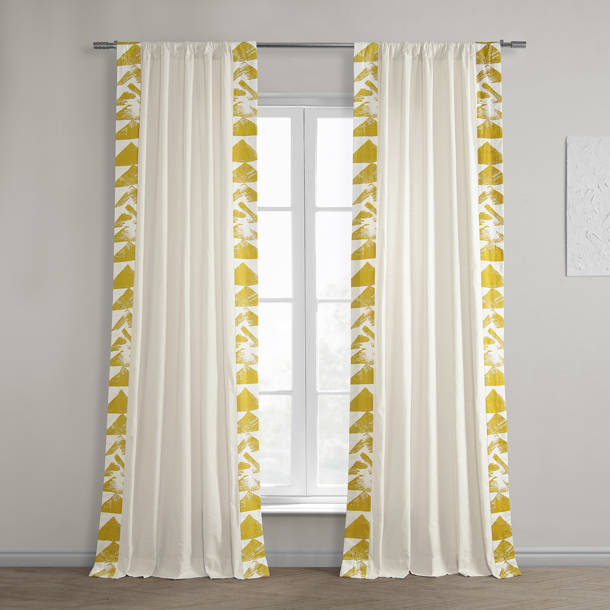
Locate an element on the screen. This screenshot has width=610, height=610. curtain rod is located at coordinates (309, 43).